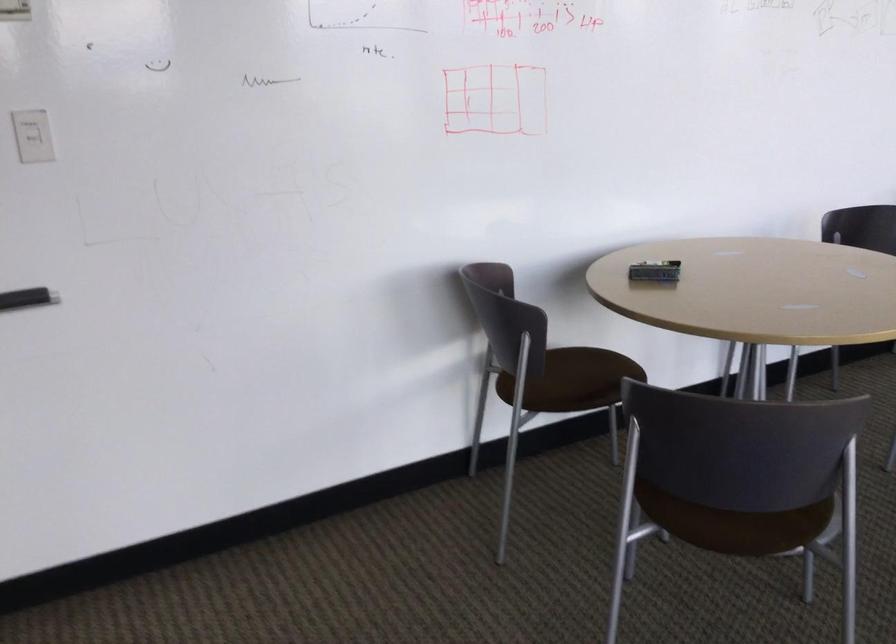
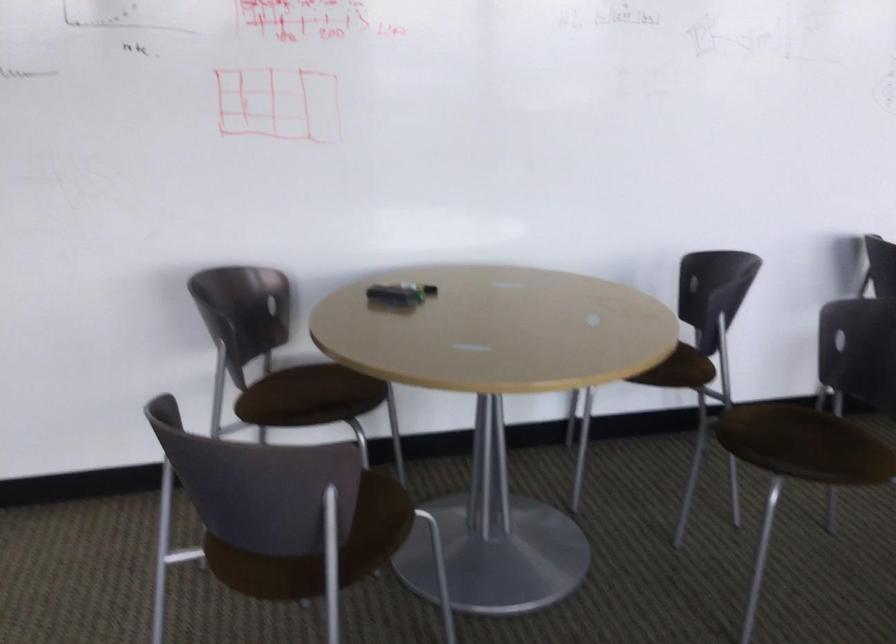
Question: In a continuous first-person perspective shot, in which direction is the camera moving?

Choices:
 (A) Left
 (B) Right
 (C) Forward
 (D) Backward

Answer: (B)